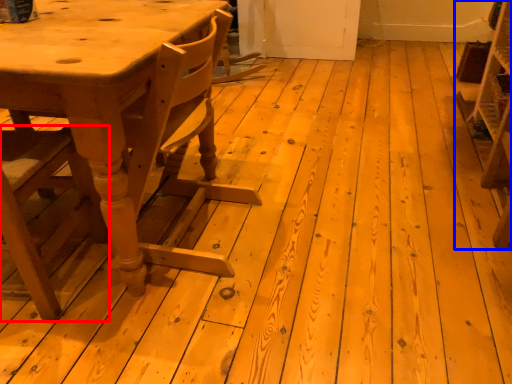
Question: Among these objects, which one is nearest to the camera, chair (highlighted by a red box) or shelf (highlighted by a blue box)?

Choices:
 (A) chair
 (B) shelf

Answer: (A)